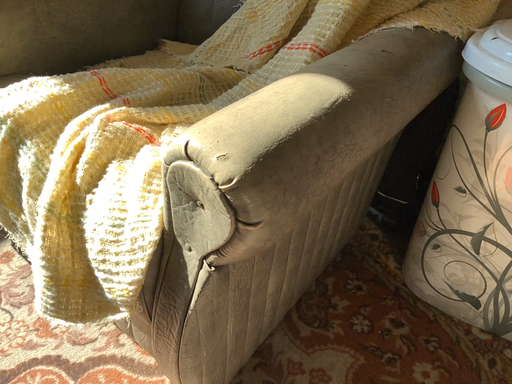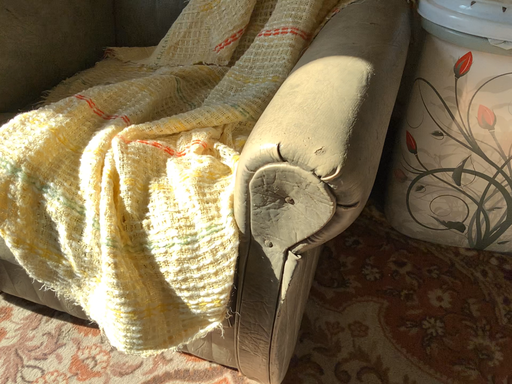
Question: Which way did the camera rotate in the video?

Choices:
 (A) rotated left
 (B) rotated right

Answer: (B)